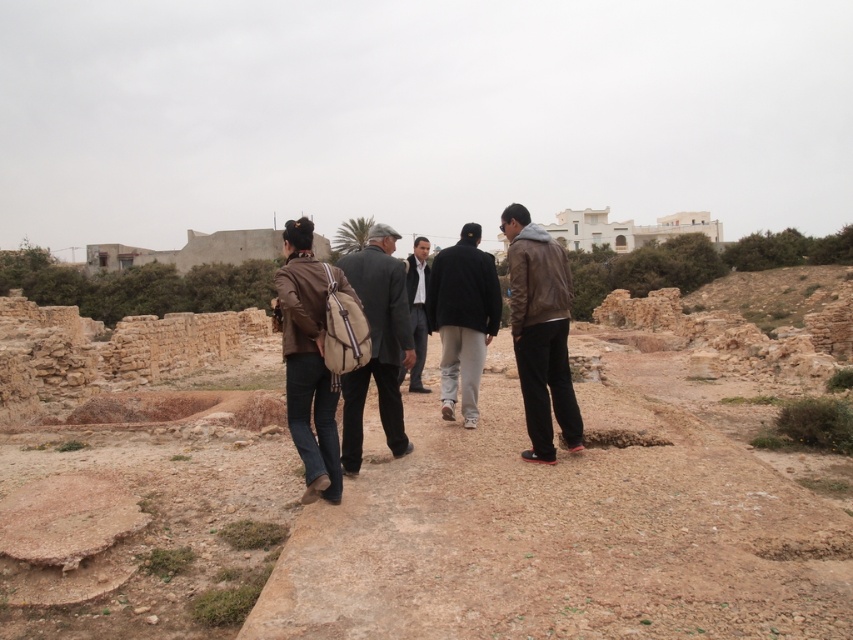
Is point (318, 460) more distant than point (473, 339)?

That is False.

Is matte brown leather jacket at center to the left of black leather jacket at center from the viewer's perspective?

Indeed, matte brown leather jacket at center is positioned on the left side of black leather jacket at center.

Identify the location of matte brown leather jacket at center. The height and width of the screenshot is (640, 853). (308, 362).

Image resolution: width=853 pixels, height=640 pixels. I want to click on matte brown leather jacket at center, so click(x=308, y=362).

Is brown dirt path at center to the left of brown leather jacket at center from the viewer's perspective?

In fact, brown dirt path at center is to the right of brown leather jacket at center.

Who is higher up, brown dirt path at center or brown leather jacket at center?

brown leather jacket at center

Who is more distant from viewer, (596, 509) or (578, 417)?

Point (578, 417)

The height and width of the screenshot is (640, 853). In order to click on brown dirt path at center in this screenshot , I will do `click(563, 531)`.

Who is positioned more to the left, brown dirt path at center or dark brown leather jacket at center?

dark brown leather jacket at center is more to the left.

Based on the photo, does brown dirt path at center have a smaller size compared to dark brown leather jacket at center?

No, brown dirt path at center is not smaller than dark brown leather jacket at center.

Is point (405, 531) more distant than point (384, 292)?

No, (405, 531) is closer to viewer.

You are a GUI agent. You are given a task and a screenshot of the screen. Output one action in this format:
    pyautogui.click(x=<x>, y=<y>)
    Task: Click on the brown dirt path at center
    This screenshot has height=640, width=853.
    Given the screenshot: What is the action you would take?
    pyautogui.click(x=563, y=531)